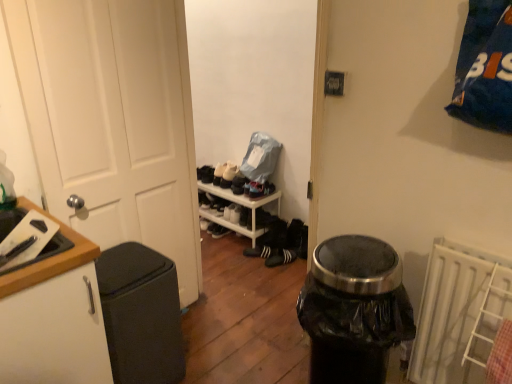
I want to click on free point in front of black suede sneakers at center, which is the 2th footwear in left-to-right order, so click(x=275, y=265).